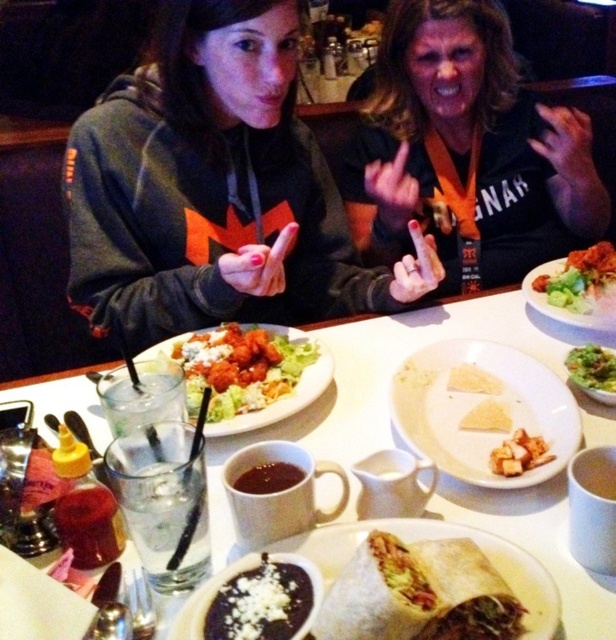
Question: Which of the following is the closest to the observer?

Choices:
 (A) yellow crumbly at center
 (B) matte brown burrito at center
 (C) shiny red sauce at center

Answer: (B)

Question: Considering the relative positions of white ceramic plate at center and white crumbly cheese at center in the image provided, where is white ceramic plate at center located with respect to white crumbly cheese at center?

Choices:
 (A) above
 (B) below

Answer: (B)

Question: In this image, where is white ceramic plate at center located relative to white matte plate at center?

Choices:
 (A) above
 (B) below

Answer: (A)

Question: Which object appears farthest from the camera in this image?

Choices:
 (A) orange lanyard at center
 (B) dark brown creamy soup at center

Answer: (A)

Question: Estimate the real-world distances between objects in this image. Which object is farther from the green leafy salad at upper right?

Choices:
 (A) matte black hoodie at upper left
 (B) dark brown creamy soup at center
 (C) shiny red sauce at center
 (D) white crumbly cheese at center

Answer: (B)

Question: Does matte brown burrito at center appear under green leafy salad at upper right?

Choices:
 (A) no
 (B) yes

Answer: (B)